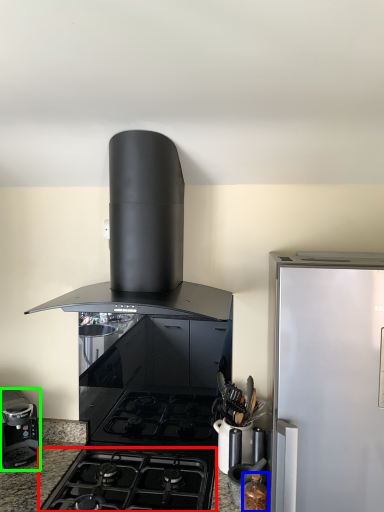
Question: Which object is the farthest from gas stove (highlighted by a red box)? Choose among these: kitchen appliance (highlighted by a blue box) or kitchen appliance (highlighted by a green box).

Choices:
 (A) kitchen appliance
 (B) kitchen appliance

Answer: (A)